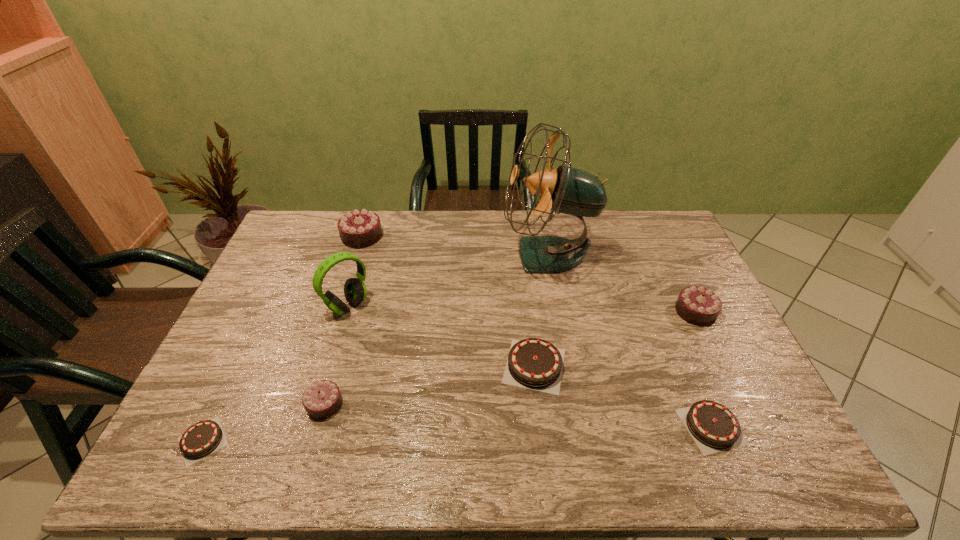
This screenshot has width=960, height=540. Identify the location of vacant space that's between the green headset and the shortest object. click(x=276, y=373).

I want to click on free space that is in between the nearest chocolate chocolate cake and the rightmost brown chocolate cake, so click(517, 415).

Identify the location of object that is the third closest one to the sixth shortest object. (322, 399).

The height and width of the screenshot is (540, 960). In order to click on object that is the closest to the sixth shortest object in this screenshot , I will do `click(355, 291)`.

The width and height of the screenshot is (960, 540). In order to click on the closest chocolate cake to the fan in this screenshot , I will do `click(699, 306)`.

Select which chocolate cake is the fifth closest to the second brown chocolate cake from right to left. Please provide its 2D coordinates. Your answer should be formatted as a tuple, i.e. [(x, y)], where the tuple contains the x and y coordinates of a point satisfying the conditions above.

[(203, 438)]

Where is `chocolate chocolate cake that is the closest to the second farthest chocolate chocolate cake`? The image size is (960, 540). chocolate chocolate cake that is the closest to the second farthest chocolate chocolate cake is located at coordinates (322, 399).

Locate which chocolate chocolate cake ranks second in proximity to the smallest chocolate chocolate cake. Please provide its 2D coordinates. Your answer should be formatted as a tuple, i.e. [(x, y)], where the tuple contains the x and y coordinates of a point satisfying the conditions above.

[(699, 306)]

Find the location of a particular element. brown chocolate cake that is the closest to the leftmost object is located at coordinates (533, 363).

Locate which brown chocolate cake ranks third in proximity to the rightmost chocolate chocolate cake. Please provide its 2D coordinates. Your answer should be formatted as a tuple, i.e. [(x, y)], where the tuple contains the x and y coordinates of a point satisfying the conditions above.

[(203, 438)]